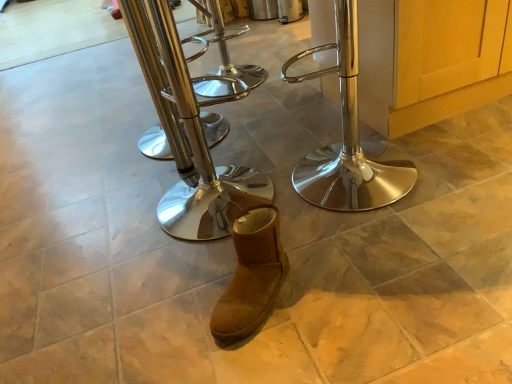
At what (x,y) coordinates should I click in order to perform the action: click on space that is in front of brown suede boot at center. Please return your answer as a coordinate pair (x, y). The height and width of the screenshot is (384, 512). Looking at the image, I should click on (273, 350).